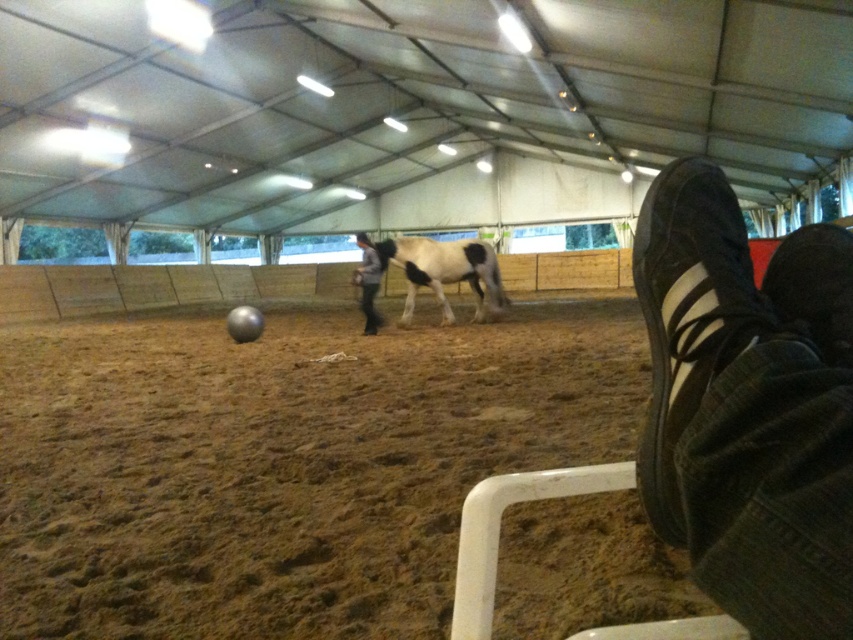
Looking at this image, you are a new visitor to the equestrian arena and you see the black suede shoe at lower right and the white and black speckled horse at center. Which object is smaller in size?

The black suede shoe at lower right is smaller in size compared to the white and black speckled horse at center.

You are standing at point (370,289) in the equestrian arena. You want to move to point (393,240). Which direction should you walk to reach your destination?

To reach point (393,240) from point (370,289), you should walk backward since point (393,240) is behind point (370,289).

You are standing at the entrance of the equestrian arena and notice a black suede shoe at lower right. Where exactly is the black suede shoe located in the arena?

The black suede shoe at lower right is located at point (688, 314).